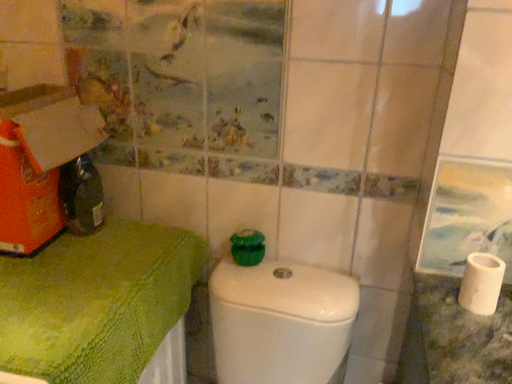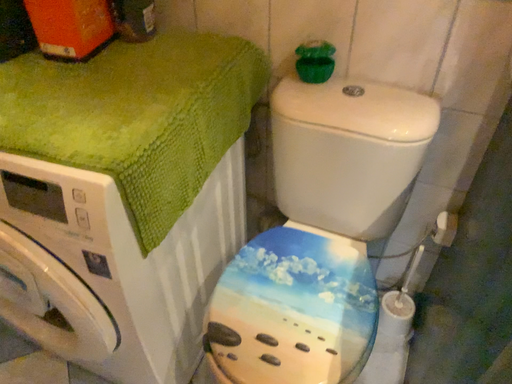
Question: Which way did the camera rotate in the video?

Choices:
 (A) rotated upward
 (B) rotated downward

Answer: (B)